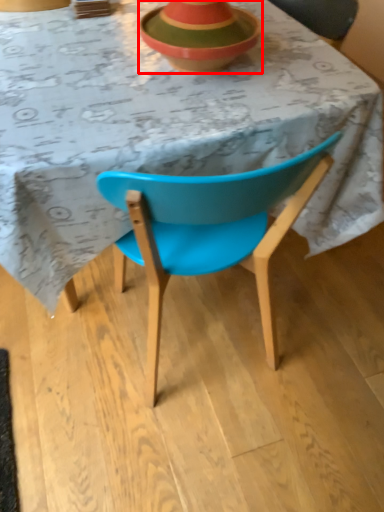
Question: In this image, where is bowl (annotated by the red box) located relative to table?

Choices:
 (A) right
 (B) left

Answer: (A)